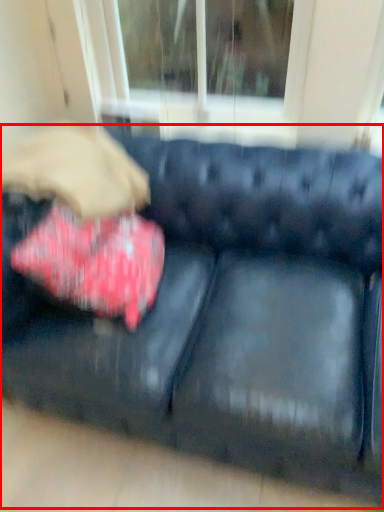
Question: From the image's perspective, where is studio couch (annotated by the red box) located relative to throw pillow?

Choices:
 (A) below
 (B) above

Answer: (A)